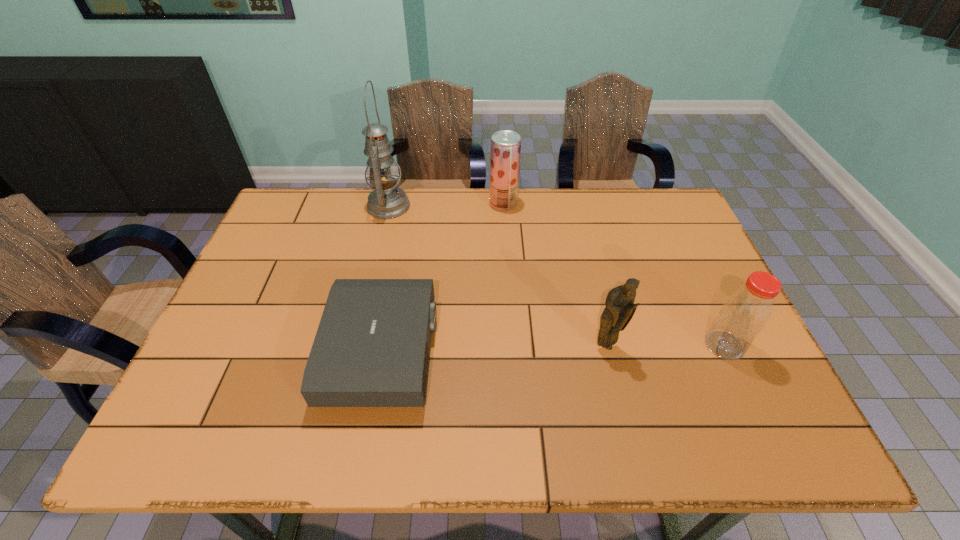
The image size is (960, 540). I want to click on oil lamp that is at the far edge, so click(x=387, y=201).

Locate an element on the screen. The width and height of the screenshot is (960, 540). fruit juice situated at the far edge is located at coordinates (x=505, y=150).

This screenshot has width=960, height=540. What are the coordinates of `object that is at the near edge` in the screenshot? It's located at (372, 346).

What are the coordinates of `object at the right edge` in the screenshot? It's located at (745, 313).

Where is `blank space at the far edge of the desktop`? blank space at the far edge of the desktop is located at coordinates (348, 191).

At what (x,y) coordinates should I click in order to perform the action: click on free space at the near edge. Please return your answer as a coordinate pair (x, y). The image size is (960, 540). Looking at the image, I should click on (492, 412).

Where is `vacant space at the left edge of the desktop`? This screenshot has height=540, width=960. vacant space at the left edge of the desktop is located at coordinates (210, 379).

Where is `free space at the right edge of the desktop`? free space at the right edge of the desktop is located at coordinates (778, 396).

In the image, there is a desktop. At what (x,y) coordinates should I click in order to perform the action: click on free space at the far right corner. Please return your answer as a coordinate pair (x, y). This screenshot has height=540, width=960. Looking at the image, I should click on (660, 193).

Where is `vacant space that's between the tallest object and the fourth object from left to right`? The image size is (960, 540). vacant space that's between the tallest object and the fourth object from left to right is located at coordinates (497, 276).